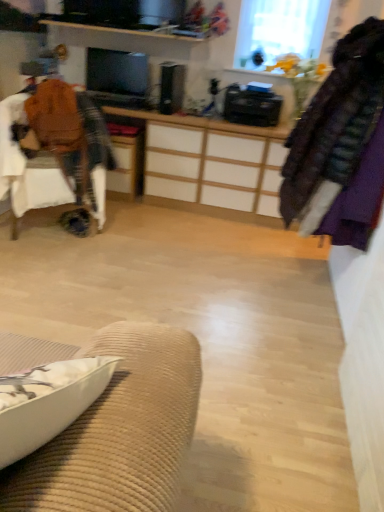
The width and height of the screenshot is (384, 512). Identify the location of free space underneath velvet purple coat at right (from a real-world perspective). (300, 289).